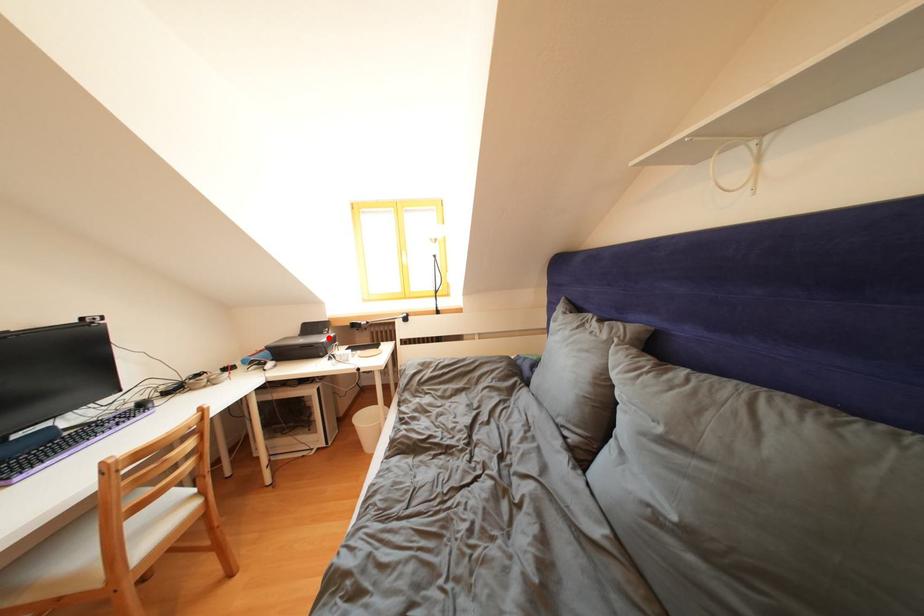
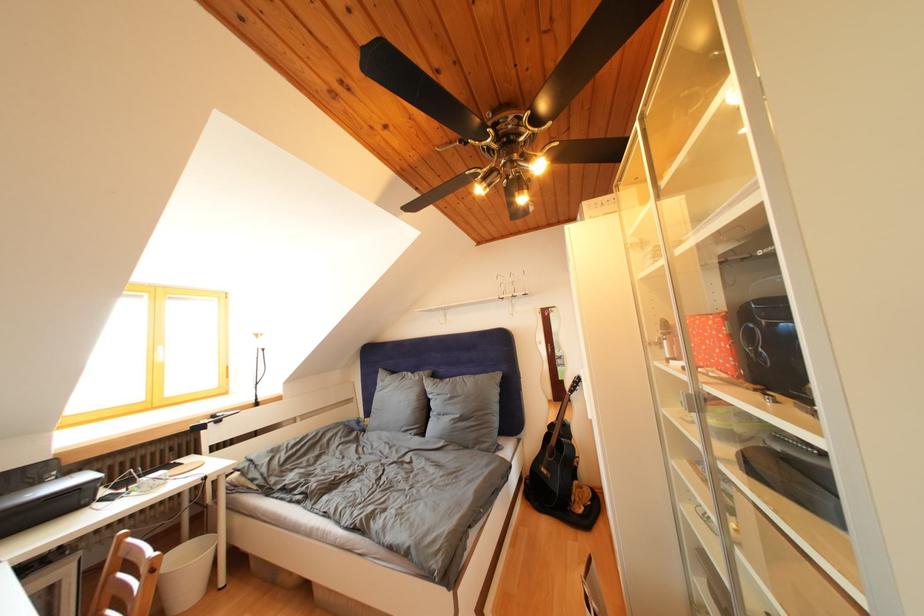
Question: A red point is marked in image1. In image2, is the corresponding 3D point closer to the camera or farther? Reply with the corresponding letter.

Choices:
 (A) The corresponding 3D point is closer.
 (B) The corresponding 3D point is farther.

Answer: (A)